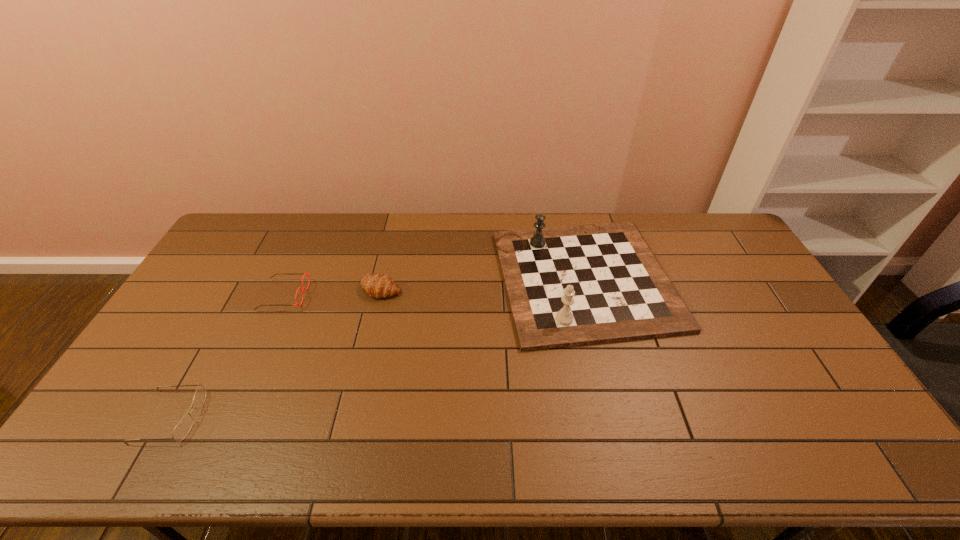
The height and width of the screenshot is (540, 960). In order to click on blank space located 0.110m on the front-facing side of the nearer spectacles in this screenshot , I will do `click(242, 417)`.

You are a GUI agent. You are given a task and a screenshot of the screen. Output one action in this format:
    pyautogui.click(x=<x>, y=<y>)
    Task: Click on the object present at the far edge
    This screenshot has height=540, width=960.
    Given the screenshot: What is the action you would take?
    pyautogui.click(x=567, y=286)

This screenshot has height=540, width=960. What are the coordinates of `object that is at the near edge` in the screenshot? It's located at (182, 429).

The height and width of the screenshot is (540, 960). What are the coordinates of `object that is positioned at the left edge` in the screenshot? It's located at (182, 429).

Locate an element on the screen. This screenshot has height=540, width=960. object that is at the near left corner is located at coordinates (182, 429).

Where is `free space at the far edge of the desktop`? free space at the far edge of the desktop is located at coordinates (408, 237).

Find the location of a particular element. Image resolution: width=960 pixels, height=540 pixels. vacant space at the near edge of the desktop is located at coordinates (406, 462).

The image size is (960, 540). In the image, there is a desktop. What are the coordinates of `free space at the right edge` in the screenshot? It's located at (810, 392).

The image size is (960, 540). I want to click on free space between the tallest object and the third object from left to right, so click(483, 284).

Identify the location of empty location between the third object from left to right and the rightmost object. tap(483, 284).